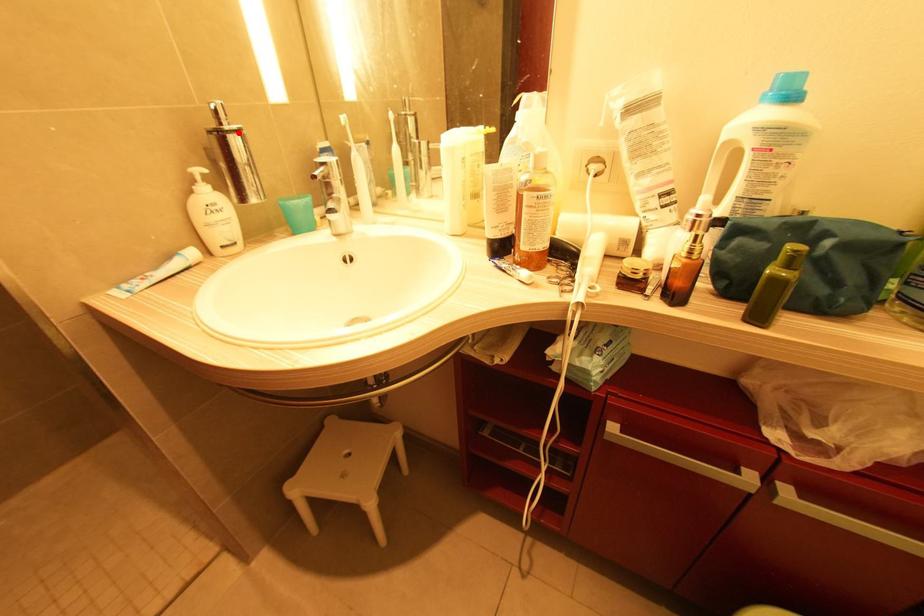
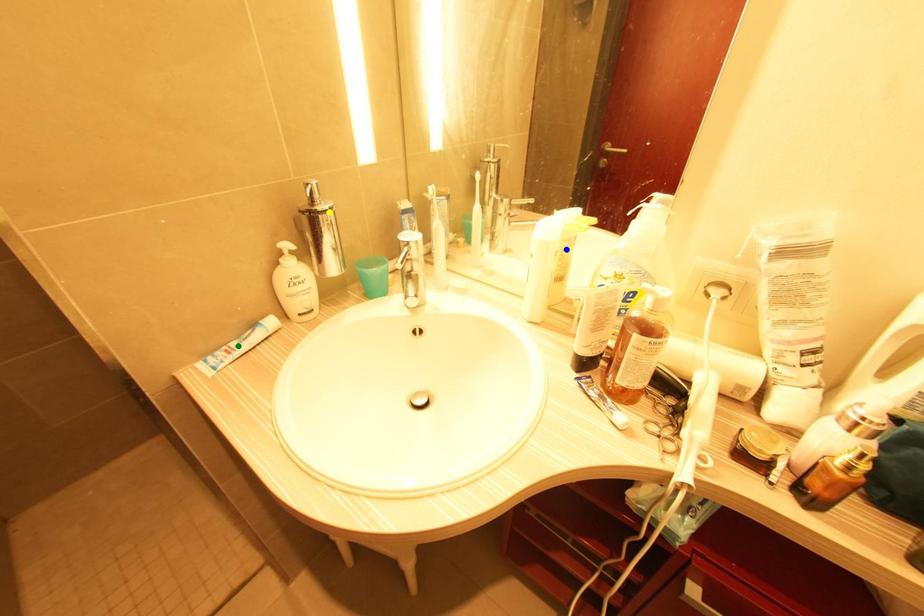
Question: I am providing you with two images of the same scene from different viewpoints. A red point is marked on the first image. You are given multiple points on the second image. Which mark in image 2 goes with the point in image 1?

Choices:
 (A) green point
 (B) yellow point
 (C) blue point

Answer: (B)